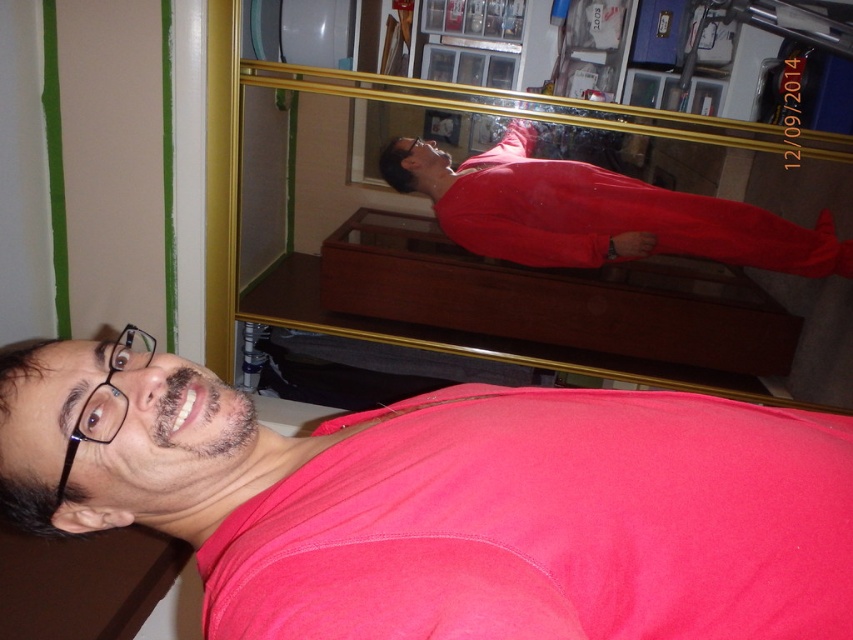
Question: Which point appears farthest from the camera in this image?

Choices:
 (A) (372, 513)
 (B) (473, 227)
 (C) (381, 296)

Answer: (C)

Question: Is the position of glossy glass mirror at upper center more distant than that of matte red jumpsuit at center?

Choices:
 (A) yes
 (B) no

Answer: (B)

Question: Which of the following is the farthest from the observer?

Choices:
 (A) matte red jumpsuit at center
 (B) pink matte shirt at lower center

Answer: (A)

Question: Is glossy glass mirror at upper center thinner than matte red jumpsuit at center?

Choices:
 (A) no
 (B) yes

Answer: (A)

Question: Which object is closer to the camera taking this photo?

Choices:
 (A) pink matte shirt at lower center
 (B) glossy glass mirror at upper center

Answer: (A)

Question: Can you confirm if pink matte shirt at lower center is thinner than matte red jumpsuit at center?

Choices:
 (A) no
 (B) yes

Answer: (B)